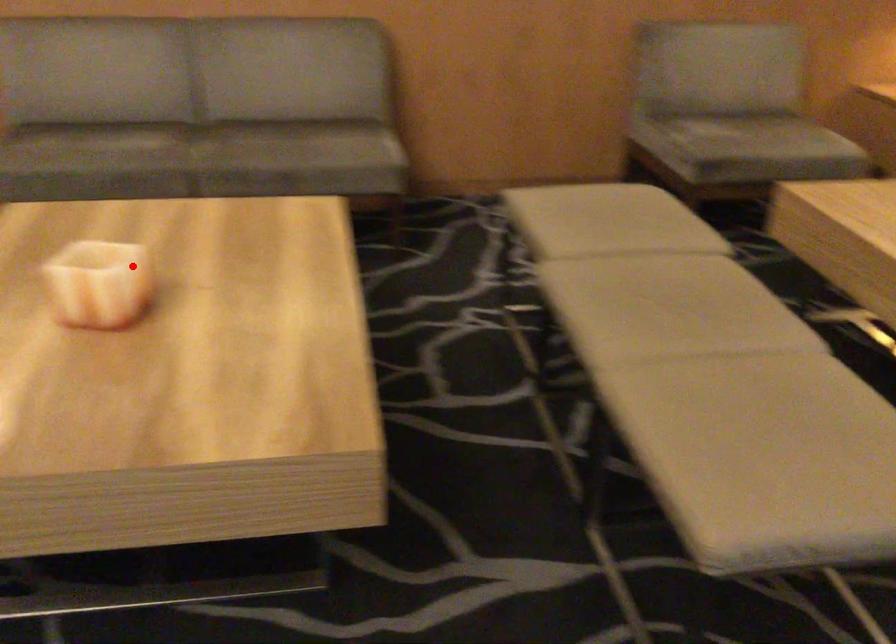
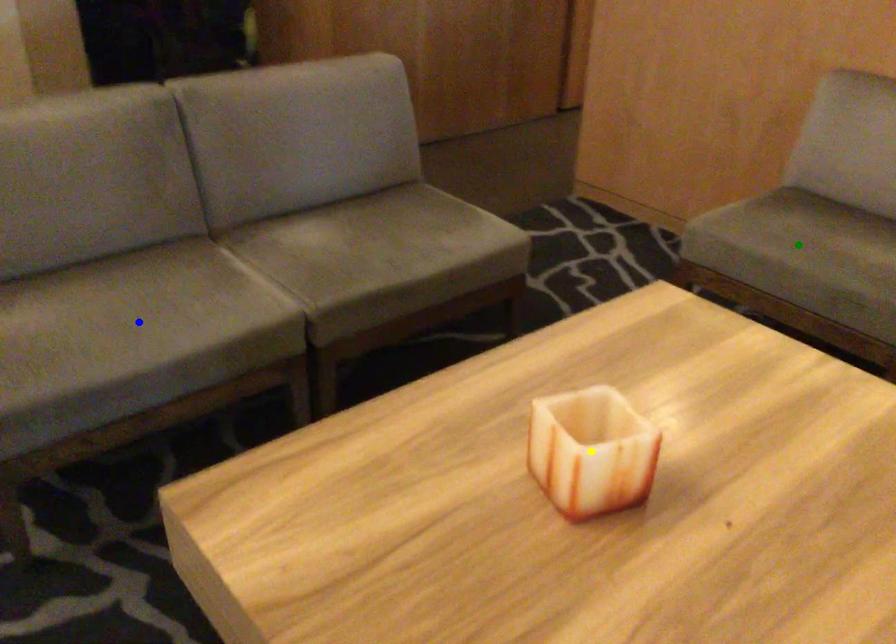
Question: I am providing you with two images of the same scene from different viewpoints. A red point is marked on the first image. You are given multiple points on the second image. Which point in image 2 represents the same 3d spot as the red point in image 1?

Choices:
 (A) yellow point
 (B) blue point
 (C) green point

Answer: (A)